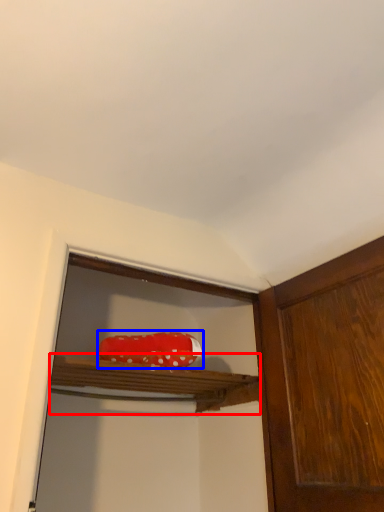
Question: Which point is closer to the camera, cabinet (highlighted by a red box) or stuff (highlighted by a blue box)?

Choices:
 (A) cabinet
 (B) stuff

Answer: (A)